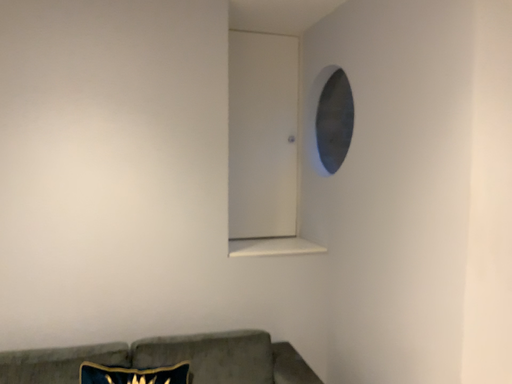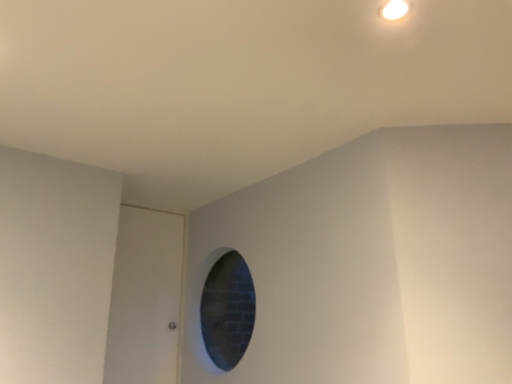
Question: Which way did the camera rotate in the video?

Choices:
 (A) rotated left
 (B) rotated right

Answer: (B)